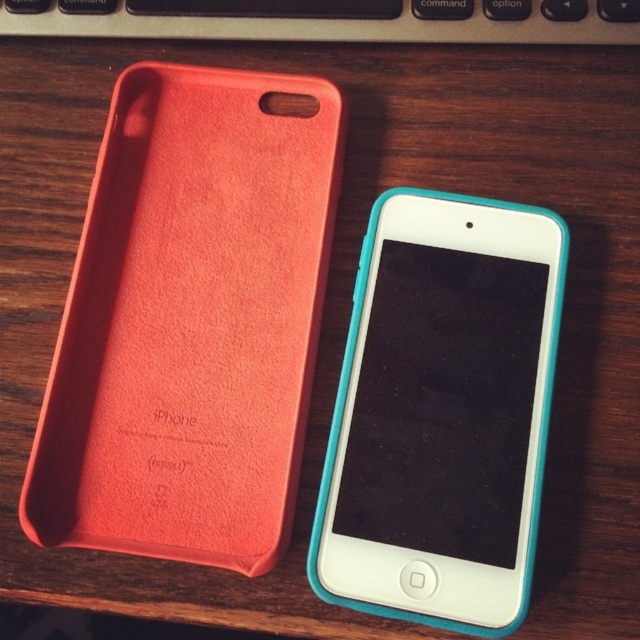
Question: Which point is closer to the camera?

Choices:
 (A) (417, 269)
 (B) (490, 22)

Answer: (A)

Question: Which point is farther to the camera?

Choices:
 (A) (563, 1)
 (B) (417, 556)

Answer: (A)

Question: Can you confirm if teal rubberized smartphone at center is positioned below black plastic keyboard at upper center?

Choices:
 (A) no
 (B) yes

Answer: (B)

Question: Does teal rubberized smartphone at center have a greater width compared to black plastic keyboard at upper center?

Choices:
 (A) yes
 (B) no

Answer: (B)

Question: Is teal rubberized smartphone at center to the right of black plastic keyboard at upper center from the viewer's perspective?

Choices:
 (A) no
 (B) yes

Answer: (B)